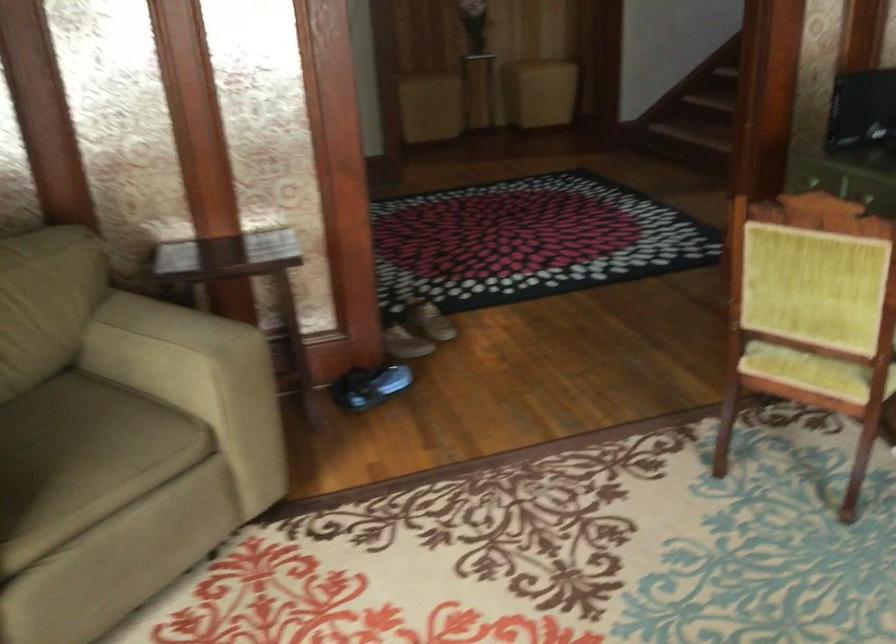
Locate an element on the screen. The width and height of the screenshot is (896, 644). sofa armrest is located at coordinates (153, 345).